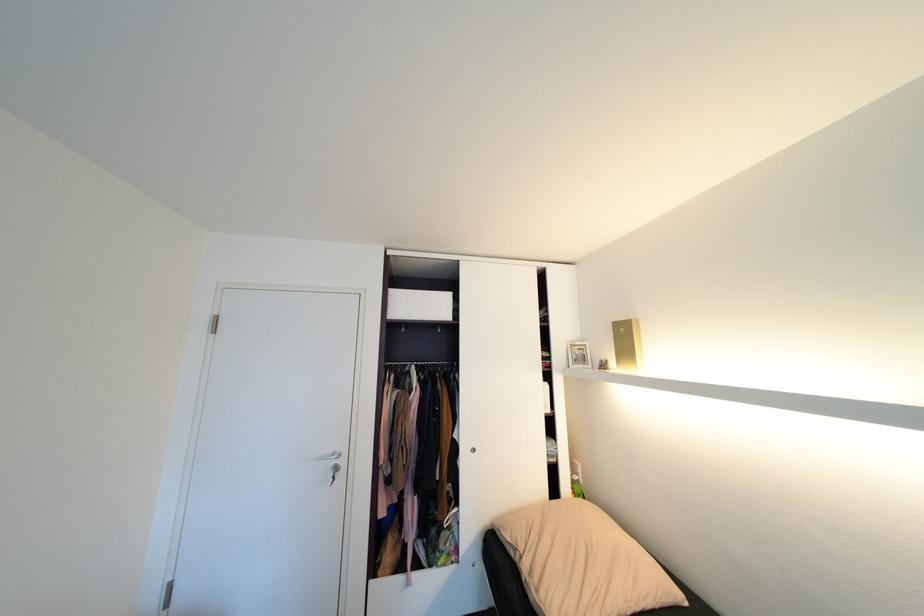
The image size is (924, 616). In order to click on metal door handle in this screenshot , I will do `click(332, 461)`.